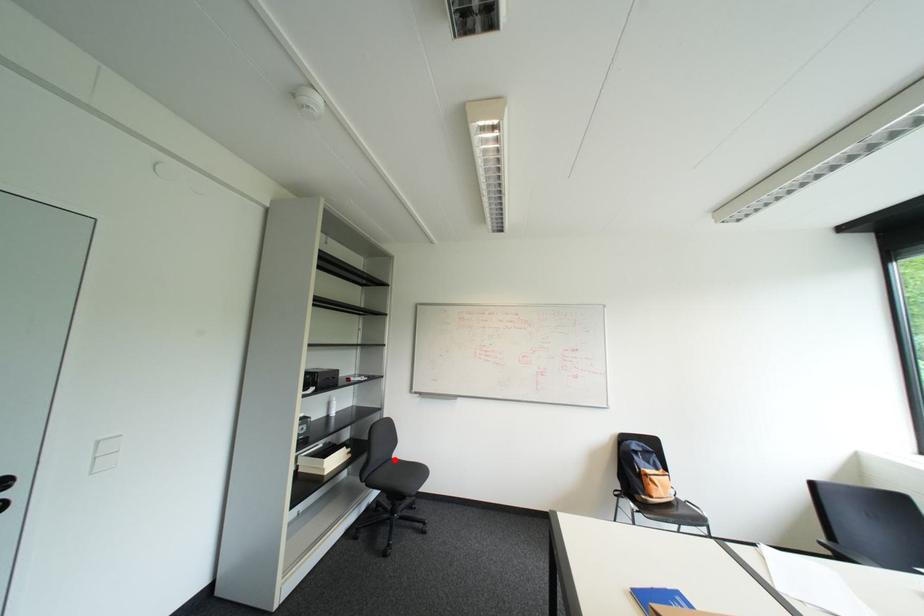
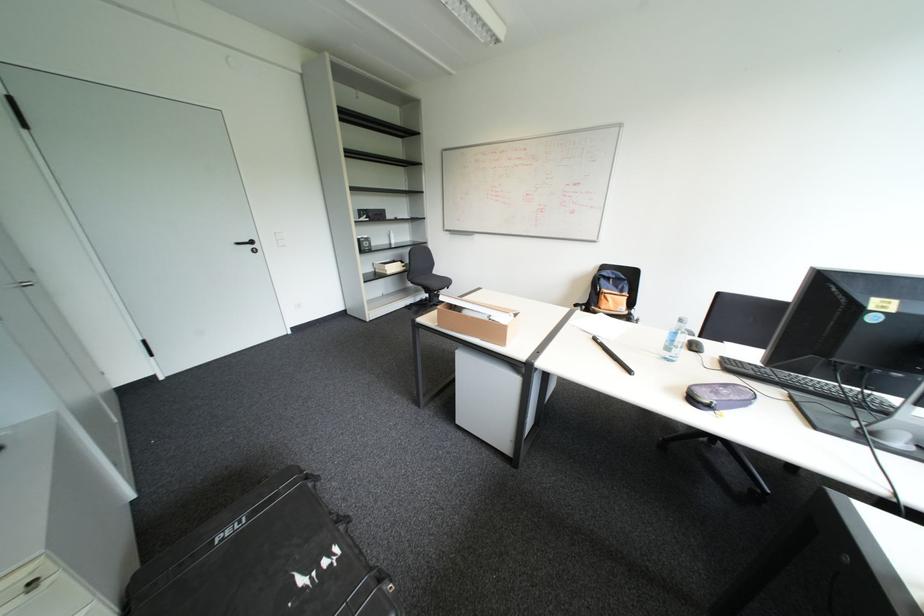
The point at the highlighted location is marked in the first image. Where is the corresponding point in the second image?

(434, 273)